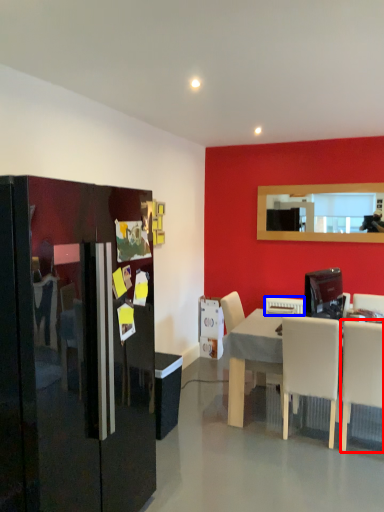
Question: Among these objects, which one is nearest to the camera, chair (highlighted by a red box) or appliance (highlighted by a blue box)?

Choices:
 (A) chair
 (B) appliance

Answer: (A)